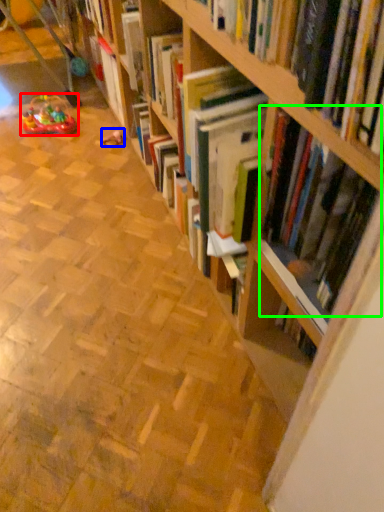
Question: Which object is positioned farthest from toy (highlighted by a red box)? Select from toy (highlighted by a blue box) and book (highlighted by a green box).

Choices:
 (A) toy
 (B) book

Answer: (B)